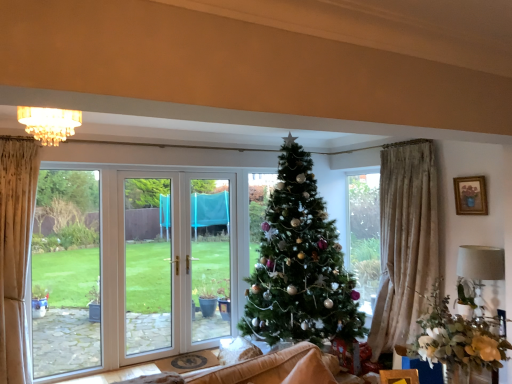
Question: Would you say wooden framed picture at upper right is a long distance from white fabric lampshade at right?

Choices:
 (A) yes
 (B) no

Answer: (B)

Question: Is wooden framed picture at upper right to the right of white fabric lampshade at right from the viewer's perspective?

Choices:
 (A) yes
 (B) no

Answer: (A)

Question: From the image's perspective, is wooden framed picture at upper right below white fabric lampshade at right?

Choices:
 (A) yes
 (B) no

Answer: (B)

Question: Considering the relative sizes of wooden framed picture at upper right and white fabric lampshade at right in the image provided, is wooden framed picture at upper right shorter than white fabric lampshade at right?

Choices:
 (A) yes
 (B) no

Answer: (A)

Question: Can you confirm if wooden framed picture at upper right is thinner than white fabric lampshade at right?

Choices:
 (A) no
 (B) yes

Answer: (B)

Question: Is wooden framed picture at upper right facing away from white fabric lampshade at right?

Choices:
 (A) yes
 (B) no

Answer: (B)

Question: Can you confirm if wooden framed picture at upper right is wider than wooden box at lower right?

Choices:
 (A) no
 (B) yes

Answer: (A)

Question: Can we say wooden framed picture at upper right lies outside wooden box at lower right?

Choices:
 (A) yes
 (B) no

Answer: (A)

Question: From a real-world perspective, is wooden framed picture at upper right over wooden box at lower right?

Choices:
 (A) no
 (B) yes

Answer: (B)

Question: Is wooden framed picture at upper right facing away from wooden box at lower right?

Choices:
 (A) yes
 (B) no

Answer: (B)

Question: From the image's perspective, is wooden framed picture at upper right under wooden box at lower right?

Choices:
 (A) no
 (B) yes

Answer: (A)

Question: Would you say wooden framed picture at upper right contains wooden box at lower right?

Choices:
 (A) no
 (B) yes

Answer: (A)

Question: Does crystal chandelier at upper center lie behind green matte christmas tree at center?

Choices:
 (A) yes
 (B) no

Answer: (B)